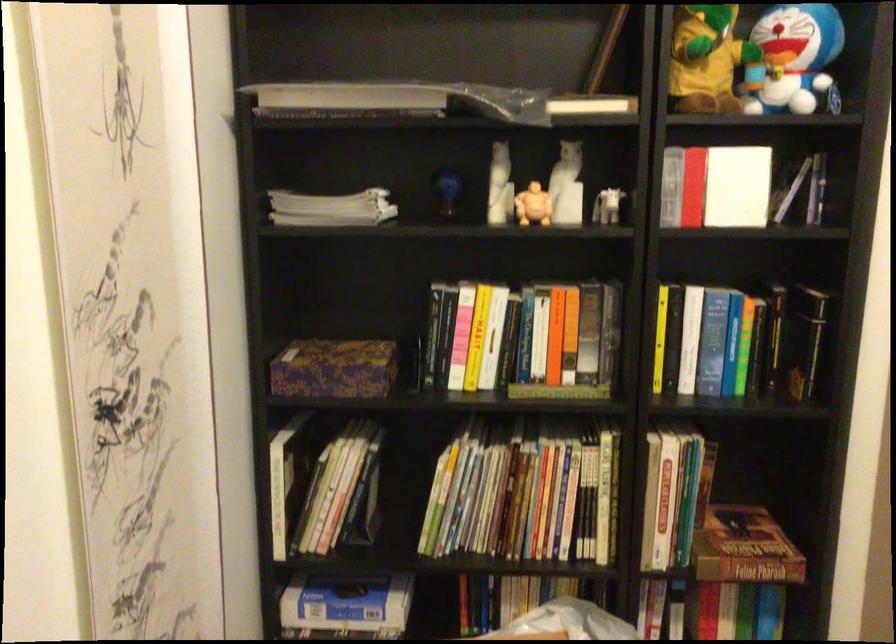
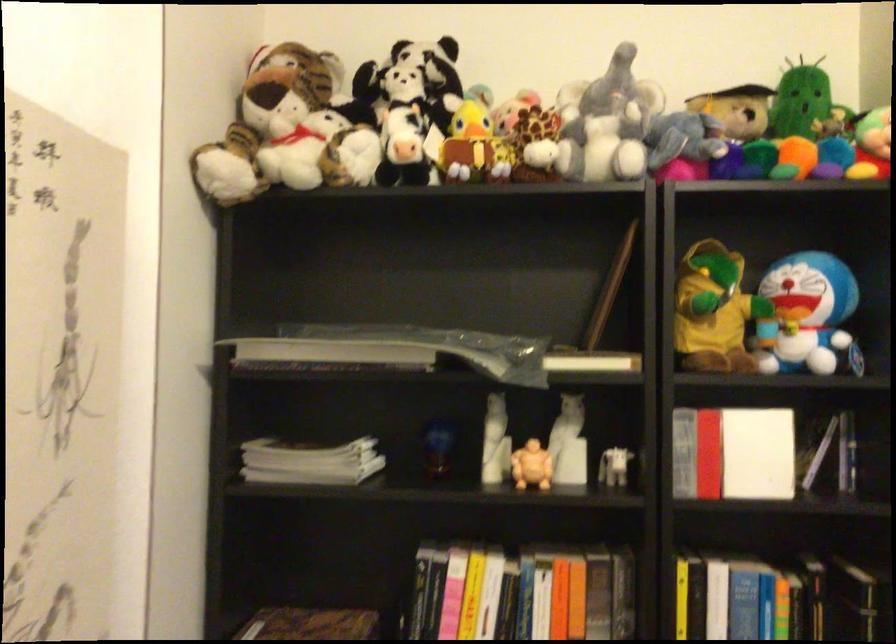
Where in the second image is the point corresponding to pixel 572 153 from the first image?

(572, 409)